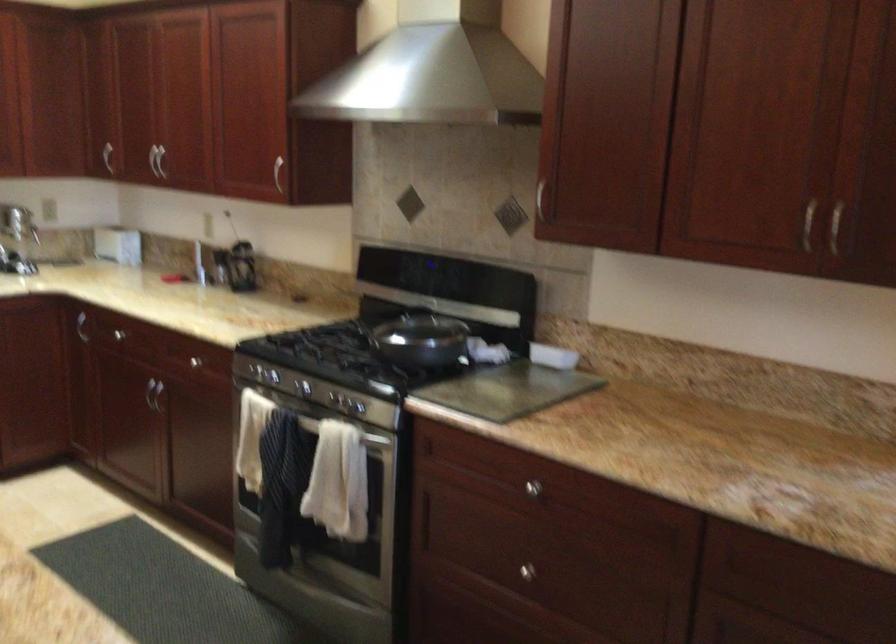
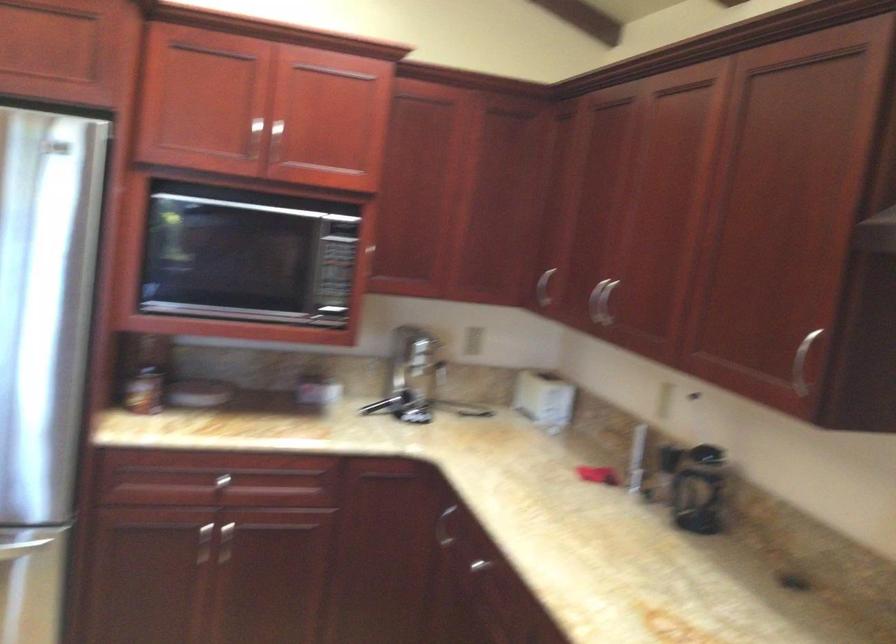
Locate, in the second image, the point that corresponds to the point at 152,151 in the first image.

(600, 301)